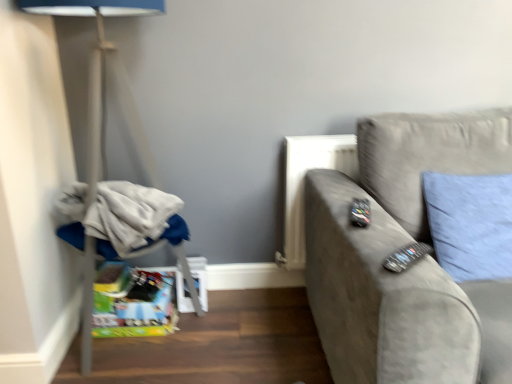
The image size is (512, 384). Describe the element at coordinates (122, 218) in the screenshot. I see `white fabric at left` at that location.

I want to click on black plastic remote at right, acting as the 1th remote starting from the top, so click(x=360, y=212).

Describe the element at coordinates (406, 257) in the screenshot. I see `black plastic remote at right, the second remote when ordered from top to bottom` at that location.

I want to click on blue fabric pillow at right, so (x=470, y=224).

This screenshot has width=512, height=384. Identify the location of white fabric at left. (x=122, y=218).

Which is farther, (127, 94) or (505, 178)?

The point (127, 94) is farther.

Which object is positioned more to the right, matte gray lamp at left or blue fabric pillow at right?

Positioned to the right is blue fabric pillow at right.

Looking at the image, does matte gray lamp at left seem bigger or smaller compared to blue fabric pillow at right?

Clearly, matte gray lamp at left is larger in size than blue fabric pillow at right.

Which is more to the left, suede gray couch at right or black plastic remote at right, positioned as the 1th remote in front-to-back order?

black plastic remote at right, positioned as the 1th remote in front-to-back order.

From the image's perspective, would you say suede gray couch at right is positioned over black plastic remote at right, the second remote when ordered from top to bottom?

No, from the image's perspective, suede gray couch at right is not over black plastic remote at right, the second remote when ordered from top to bottom.

Does suede gray couch at right lie behind black plastic remote at right, arranged as the 1th remote when ordered from the bottom?

No, it is not.

Could you tell me if suede gray couch at right is turned towards blue fabric pillow at right?

Yes.

From the image's perspective, does suede gray couch at right appear higher than blue fabric pillow at right?

Actually, suede gray couch at right appears below blue fabric pillow at right in the image.

Does point (496, 137) come behind point (459, 252)?

Yes.

Based on the photo, could you tell me if black plastic remote at right, the first remote in the back-to-front sequence, is turned towards suede gray couch at right?

Yes, black plastic remote at right, the first remote in the back-to-front sequence, is facing suede gray couch at right.

Which is more to the left, black plastic remote at right, the first remote in the back-to-front sequence, or suede gray couch at right?

black plastic remote at right, the first remote in the back-to-front sequence.

From the image's perspective, is black plastic remote at right, which is counted as the second remote, starting from the front, beneath suede gray couch at right?

No.

From the picture: Which object is further away from the camera, black plastic remote at right, the first remote in the back-to-front sequence, or suede gray couch at right?

black plastic remote at right, the first remote in the back-to-front sequence, is more distant.

Considering the relative sizes of black plastic remote at right, which is counted as the second remote, starting from the front, and matte gray lamp at left in the image provided, is black plastic remote at right, which is counted as the second remote, starting from the front, smaller than matte gray lamp at left?

Correct, black plastic remote at right, which is counted as the second remote, starting from the front, occupies less space than matte gray lamp at left.

Could matte gray lamp at left be considered to be inside black plastic remote at right, which is counted as the second remote, starting from the front?

No, matte gray lamp at left is located outside of black plastic remote at right, which is counted as the second remote, starting from the front.

Is black plastic remote at right, which is counted as the second remote, starting from the front, next to matte gray lamp at left and touching it?

black plastic remote at right, which is counted as the second remote, starting from the front, and matte gray lamp at left are clearly separated.

Is matte gray lamp at left at the back of black plastic remote at right, acting as the 1th remote starting from the top?

Absolutely, black plastic remote at right, acting as the 1th remote starting from the top, is directed away from matte gray lamp at left.

Looking at their sizes, would you say blue fabric pillow at right is wider or thinner than matte gray lamp at left?

In the image, blue fabric pillow at right appears to be more narrow than matte gray lamp at left.

Does blue fabric pillow at right have a smaller size compared to matte gray lamp at left?

Yes, blue fabric pillow at right is smaller than matte gray lamp at left.

Find the location of a particular element. table lamp in front of the blue fabric pillow at right is located at coordinates (105, 84).

Based on the photo, is blue fabric pillow at right positioned with its back to matte gray lamp at left?

No, blue fabric pillow at right is not facing away from matte gray lamp at left.

How distant is blue fabric pillow at right from black plastic remote at right, which is the 2th remote from back to front?

A distance of 18.35 inches exists between blue fabric pillow at right and black plastic remote at right, which is the 2th remote from back to front.

Between blue fabric pillow at right and black plastic remote at right, which is the 2th remote from back to front, which one has more height?

With more height is blue fabric pillow at right.

Does blue fabric pillow at right touch black plastic remote at right, the second remote when ordered from top to bottom?

blue fabric pillow at right and black plastic remote at right, the second remote when ordered from top to bottom, are clearly separated.

Is the depth of blue fabric pillow at right greater than that of black plastic remote at right, positioned as the 1th remote in front-to-back order?

Yes, blue fabric pillow at right is further from the viewer.

Identify the location of pillow that is on the right side of matte gray lamp at left. The image size is (512, 384). (470, 224).

Which remote is the 1st one when counting from the left side of the suede gray couch at right? Please provide its 2D coordinates.

[(406, 257)]

Which object lies further to the anchor point black plastic remote at right, which is the 2th remote from back to front, black plastic remote at right, which is counted as the second remote, starting from the front, or blue fabric pillow at right?

blue fabric pillow at right.

Which object lies nearer to the anchor point black plastic remote at right, the second remote when ordered from top to bottom, blue fabric pillow at right or black plastic remote at right, acting as the 1th remote starting from the top?

black plastic remote at right, acting as the 1th remote starting from the top, is positioned closer to the anchor black plastic remote at right, the second remote when ordered from top to bottom.

Estimate the real-world distances between objects in this image. Which object is further from blue fabric pillow at right, white fabric at left or suede gray couch at right?

Based on the image, white fabric at left appears to be further to blue fabric pillow at right.

From the image, which object appears to be nearer to suede gray couch at right, matte gray lamp at left or white fabric at left?

Among the two, white fabric at left is located nearer to suede gray couch at right.

Looking at the image, which one is located closer to black plastic remote at right, the second remote when ordered from top to bottom, white fabric at left or blue fabric pillow at right?

blue fabric pillow at right is positioned closer to the anchor black plastic remote at right, the second remote when ordered from top to bottom.

When comparing their distances from white fabric at left, does matte gray lamp at left or black plastic remote at right, acting as the 1th remote starting from the top, seem closer?

matte gray lamp at left is positioned closer to the anchor white fabric at left.

From the picture: When comparing their distances from black plastic remote at right, arranged as the 1th remote when ordered from the bottom, does suede gray couch at right or blue fabric pillow at right seem further?

blue fabric pillow at right is positioned further to the anchor black plastic remote at right, arranged as the 1th remote when ordered from the bottom.

Estimate the real-world distances between objects in this image. Which object is closer to white fabric at left, matte gray lamp at left or suede gray couch at right?

matte gray lamp at left is closer to white fabric at left.

Identify the location of table lamp located between white fabric at left and suede gray couch at right in the left-right direction. point(105,84).

This screenshot has height=384, width=512. Find the location of `studio couch between white fabric at left and blue fabric pillow at right in the horizontal direction`. studio couch between white fabric at left and blue fabric pillow at right in the horizontal direction is located at coordinates (395, 250).

You are a GUI agent. You are given a task and a screenshot of the screen. Output one action in this format:
    pyautogui.click(x=<x>, y=<y>)
    Task: Click on the studio couch between black plastic remote at right, the second remote when ordered from top to bottom, and blue fabric pillow at right
    The image size is (512, 384).
    Given the screenshot: What is the action you would take?
    pyautogui.click(x=395, y=250)

Find the location of `remote between white fabric at left and black plastic remote at right, positioned as the 1th remote in front-to-back order`. remote between white fabric at left and black plastic remote at right, positioned as the 1th remote in front-to-back order is located at coordinates (360, 212).